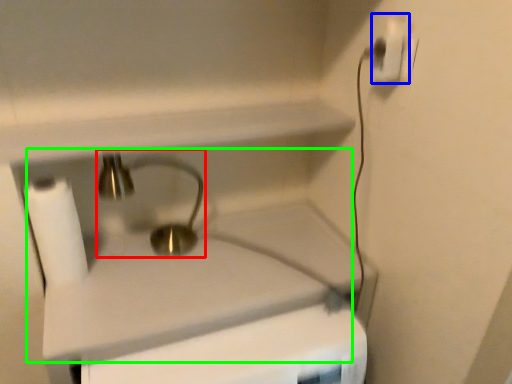
Question: Which object is the farthest from faucet (highlighted by a red box)? Choose among these: power plugs and sockets (highlighted by a blue box) or sink (highlighted by a green box).

Choices:
 (A) power plugs and sockets
 (B) sink

Answer: (A)